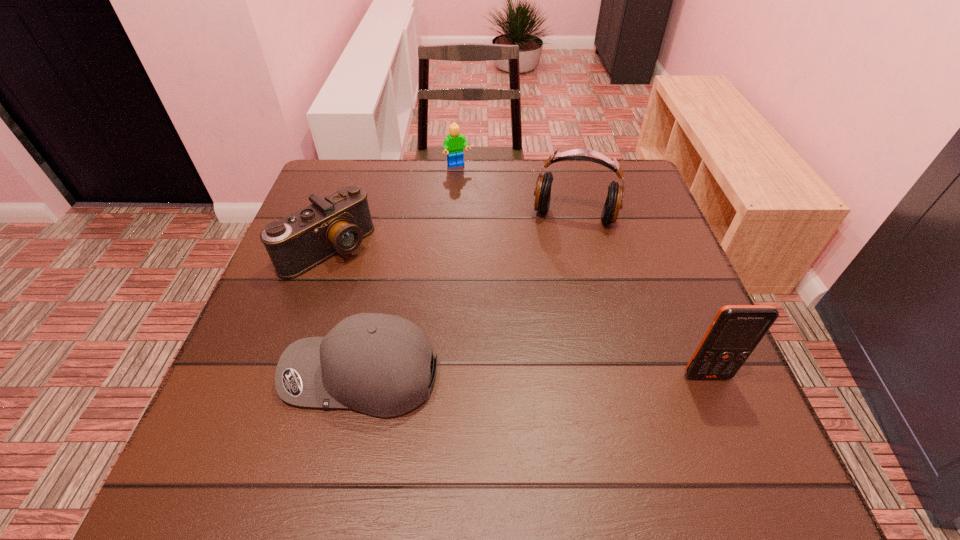
You are a GUI agent. You are given a task and a screenshot of the screen. Output one action in this format:
    pyautogui.click(x=<x>, y=<y>)
    Task: Click on the baseball cap at the left edge
    
    Given the screenshot: What is the action you would take?
    pyautogui.click(x=379, y=364)

This screenshot has height=540, width=960. In order to click on camera located at the left edge in this screenshot , I will do coord(338,223).

The height and width of the screenshot is (540, 960). Find the location of `cellular telephone situated at the right edge`. cellular telephone situated at the right edge is located at coordinates (736, 330).

Image resolution: width=960 pixels, height=540 pixels. In order to click on headset situated at the right edge in this screenshot , I will do `click(542, 192)`.

You are a GUI agent. You are given a task and a screenshot of the screen. Output one action in this format:
    pyautogui.click(x=<x>, y=<y>)
    Task: Click on the object at the near left corner
    This screenshot has width=960, height=540.
    Given the screenshot: What is the action you would take?
    pyautogui.click(x=379, y=364)

I want to click on object present at the far right corner, so click(x=542, y=192).

The width and height of the screenshot is (960, 540). I want to click on object positioned at the near right corner, so click(736, 330).

Image resolution: width=960 pixels, height=540 pixels. In the image, there is a desktop. Find the location of `free space at the far edge`. free space at the far edge is located at coordinates (495, 208).

This screenshot has width=960, height=540. In the image, there is a desktop. Find the location of `vacant space at the left edge`. vacant space at the left edge is located at coordinates (255, 318).

This screenshot has width=960, height=540. In order to click on free space at the right edge in this screenshot , I will do `click(619, 244)`.